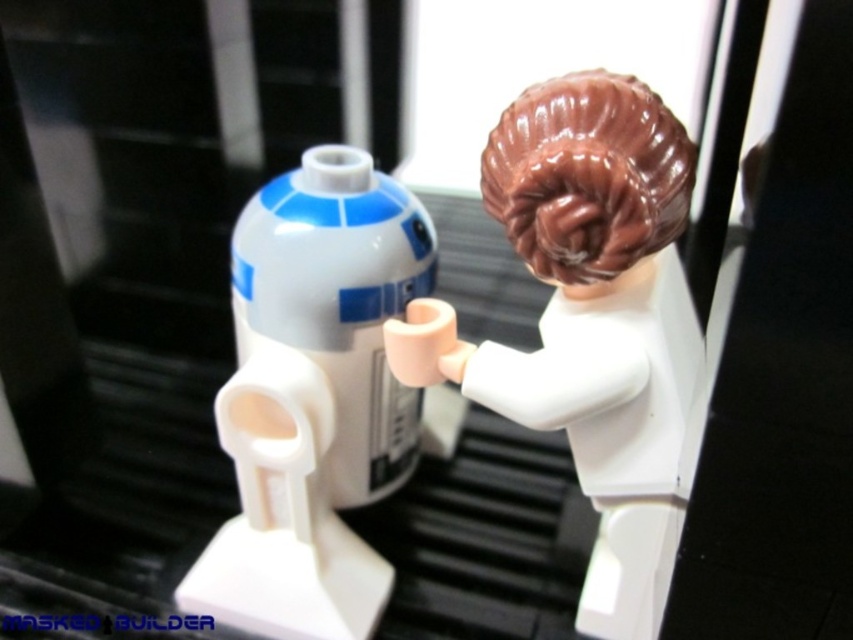
Between brown glossy hair at upper center and white plastic r2-d2 at center, which one appears on the right side from the viewer's perspective?

brown glossy hair at upper center is more to the right.

Looking at this image, can you confirm if brown glossy hair at upper center is thinner than white plastic r2-d2 at center?

No, brown glossy hair at upper center is not thinner than white plastic r2-d2 at center.

Between point (520, 202) and point (262, 524), which one is positioned in front?

Positioned in front is point (520, 202).

You are a GUI agent. You are given a task and a screenshot of the screen. Output one action in this format:
    pyautogui.click(x=<x>, y=<y>)
    Task: Click on the brown glossy hair at upper center
    
    Given the screenshot: What is the action you would take?
    pyautogui.click(x=590, y=320)